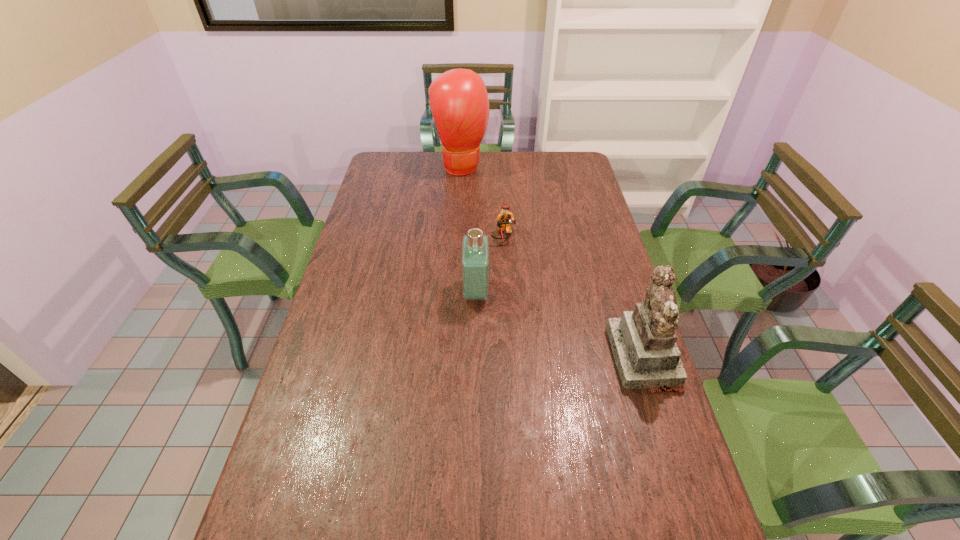
This screenshot has height=540, width=960. What are the coordinates of `the third farthest object` in the screenshot? It's located at (475, 249).

This screenshot has width=960, height=540. I want to click on the third tallest object, so click(x=475, y=249).

Identify the location of the second tallest object. (643, 342).

Image resolution: width=960 pixels, height=540 pixels. I want to click on figurine, so click(643, 342).

In order to click on the tallest object in this screenshot , I will do `click(459, 102)`.

The width and height of the screenshot is (960, 540). I want to click on the farthest object, so click(x=459, y=102).

Find the location of a particular element. This screenshot has width=960, height=540. Lego is located at coordinates (505, 219).

The image size is (960, 540). I want to click on the second farthest object, so coord(505,219).

Image resolution: width=960 pixels, height=540 pixels. Find the location of `vacant space situated on the front label of the third farthest object`. vacant space situated on the front label of the third farthest object is located at coordinates (610, 293).

At what (x,y) coordinates should I click in order to perform the action: click on free space located on the front-facing side of the rightmost object. Please return your answer as a coordinate pair (x, y). The height and width of the screenshot is (540, 960). Looking at the image, I should click on (555, 357).